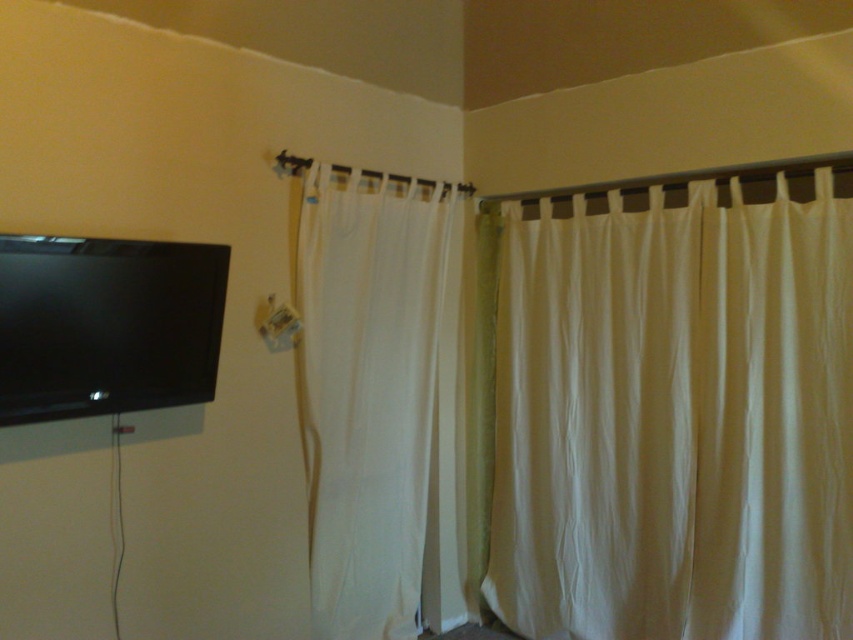
Is point (428, 224) farther from camera compared to point (3, 356)?

That is True.

Does white sheer curtain at center have a greater height compared to black glossy flat screen tv at upper left?

Yes.

Find the location of a particular element. Image resolution: width=853 pixels, height=640 pixels. white sheer curtain at center is located at coordinates (379, 397).

Where is `white sheer curtain at center`? white sheer curtain at center is located at coordinates (379, 397).

Is white sheer curtain at upper right to the left of white sheer curtain at center from the viewer's perspective?

Incorrect, white sheer curtain at upper right is not on the left side of white sheer curtain at center.

Between point (778, 476) and point (343, 224), which one is positioned behind?

Point (343, 224)

Locate an element on the screen. white sheer curtain at upper right is located at coordinates (675, 417).

Can you confirm if white sheer curtain at upper right is positioned below black glossy flat screen tv at upper left?

Correct, white sheer curtain at upper right is located below black glossy flat screen tv at upper left.

Identify the location of white sheer curtain at upper right. Image resolution: width=853 pixels, height=640 pixels. (675, 417).